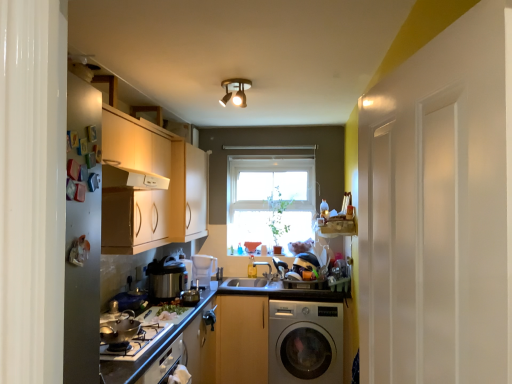
Question: From the image's perspective, is wooden cabinet at center, arranged as the first cabinetry when viewed from the right, under white plastic pitcher at center, positioned as the 1th appliance in right-to-left order?

Choices:
 (A) no
 (B) yes

Answer: (B)

Question: Can you confirm if wooden cabinet at center, marked as the first cabinetry in a bottom-to-top arrangement, is wider than white plastic pitcher at center, which is the second appliance in front-to-back order?

Choices:
 (A) no
 (B) yes

Answer: (B)

Question: Is wooden cabinet at center, acting as the second cabinetry starting from the top, positioned beyond the bounds of white plastic pitcher at center, which appears as the second appliance when viewed from the left?

Choices:
 (A) yes
 (B) no

Answer: (A)

Question: Is wooden cabinet at center, which is the 2th cabinetry from left to right, not near white plastic pitcher at center, which is the first appliance from back to front?

Choices:
 (A) yes
 (B) no

Answer: (B)

Question: Is wooden cabinet at center, which is the 2th cabinetry from left to right, taller than white plastic pitcher at center, which is the second appliance in front-to-back order?

Choices:
 (A) no
 (B) yes

Answer: (B)

Question: Would you say gold metallic spotlight at center is to the left or to the right of matte white countertop at lower left in the picture?

Choices:
 (A) right
 (B) left

Answer: (A)

Question: From a real-world perspective, relative to matte white countertop at lower left, is gold metallic spotlight at center vertically above or below?

Choices:
 (A) above
 (B) below

Answer: (A)

Question: In the image, is gold metallic spotlight at center positioned in front of or behind matte white countertop at lower left?

Choices:
 (A) front
 (B) behind

Answer: (B)

Question: Looking at the image, does gold metallic spotlight at center seem bigger or smaller compared to matte white countertop at lower left?

Choices:
 (A) big
 (B) small

Answer: (B)

Question: Is point (105, 377) closer or farther from the camera than point (123, 331)?

Choices:
 (A) farther
 (B) closer

Answer: (B)

Question: From the image's perspective, is matte white countertop at lower left located above or below shiny silver wok at lower left, acting as the second appliance starting from the back?

Choices:
 (A) above
 (B) below

Answer: (B)

Question: Which is correct: matte white countertop at lower left is inside shiny silver wok at lower left, acting as the second appliance starting from the back, or outside of it?

Choices:
 (A) outside
 (B) inside

Answer: (A)

Question: Considering the positions of matte white countertop at lower left and shiny silver wok at lower left, acting as the second appliance starting from the back, in the image, is matte white countertop at lower left taller or shorter than shiny silver wok at lower left, acting as the second appliance starting from the back,?

Choices:
 (A) tall
 (B) short

Answer: (A)

Question: From the image's perspective, is silver metallic washing machine at lower right above or below clear glass window at center?

Choices:
 (A) below
 (B) above

Answer: (A)

Question: Is point (313, 304) positioned closer to the camera than point (263, 182)?

Choices:
 (A) closer
 (B) farther

Answer: (A)